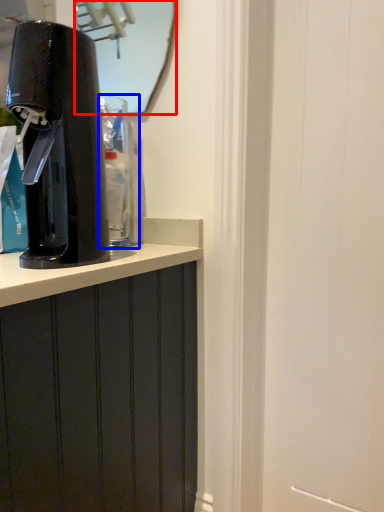
Question: Which point is further to the camera, mirror (highlighted by a red box) or water cooler (highlighted by a blue box)?

Choices:
 (A) mirror
 (B) water cooler

Answer: (A)